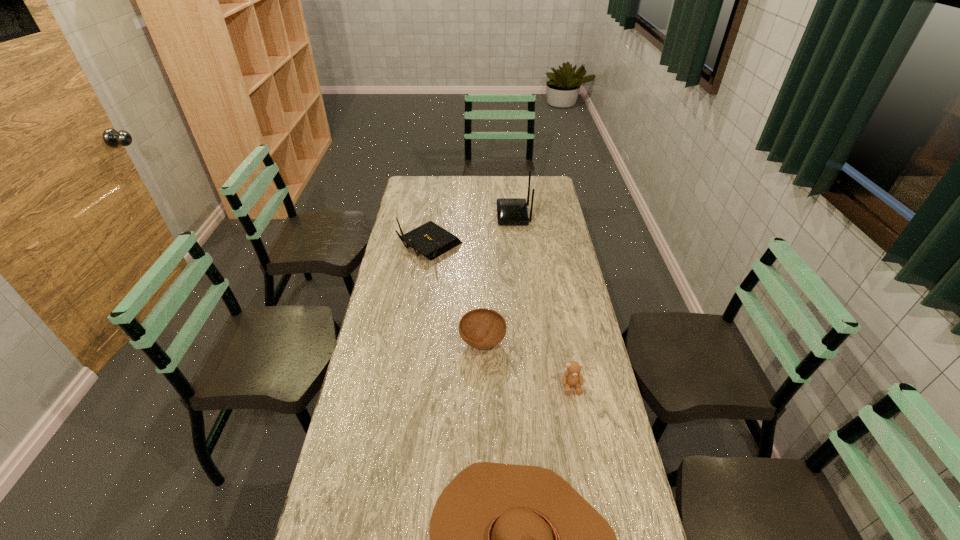
The image size is (960, 540). What are the coordinates of `vacant point located 0.300m on the face of the teddy bear` in the screenshot? It's located at (591, 493).

Identify the location of free region located on the left of the bowl. (417, 342).

At what (x,y) coordinates should I click in order to perform the action: click on object that is at the left edge. Please return your answer as a coordinate pair (x, y). The width and height of the screenshot is (960, 540). Looking at the image, I should click on (430, 240).

Locate an element on the screen. router at the right edge is located at coordinates (510, 211).

At what (x,y) coordinates should I click in order to perform the action: click on teddy bear that is at the right edge. Please return your answer as a coordinate pair (x, y). Looking at the image, I should click on (572, 377).

The height and width of the screenshot is (540, 960). In the image, there is a desktop. What are the coordinates of `free space at the far edge` in the screenshot? It's located at click(448, 179).

Where is `vacant space at the left edge of the desktop`? vacant space at the left edge of the desktop is located at coordinates (419, 296).

This screenshot has height=540, width=960. In the image, there is a desktop. What are the coordinates of `vacant space at the right edge` in the screenshot? It's located at (603, 509).

Identify the location of free space at the far right corner. The width and height of the screenshot is (960, 540). (536, 179).

The height and width of the screenshot is (540, 960). In order to click on empty space between the bowl and the tallest object in this screenshot , I will do `click(498, 279)`.